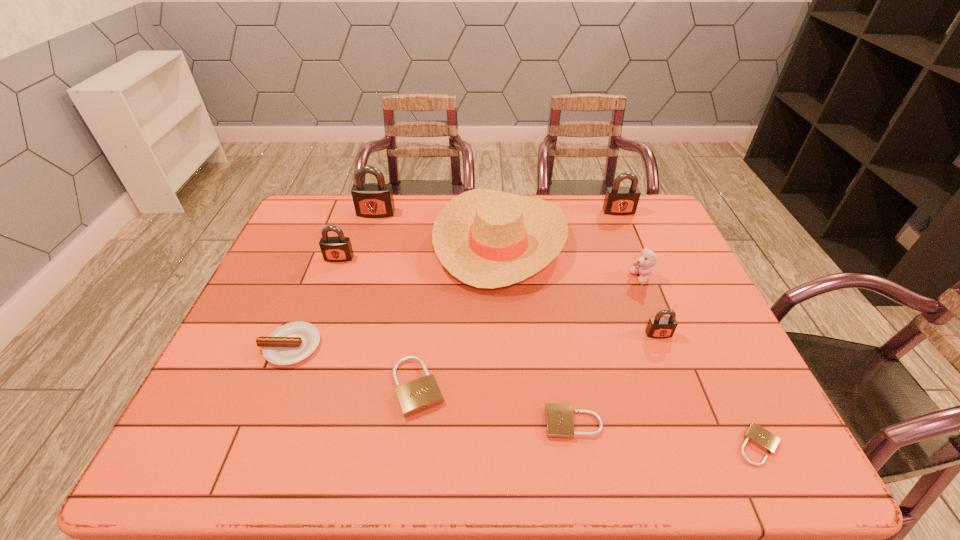
Find the location of a particular element. gray padlock that stands as the closest to the shortest object is located at coordinates (660, 327).

Choose which gray padlock is the third nearest neighbor to the fifth shortest padlock. Please provide its 2D coordinates. Your answer should be formatted as a tuple, i.e. [(x, y)], where the tuple contains the x and y coordinates of a point satisfying the conditions above.

[(660, 327)]

Find the location of a particular element. The image size is (960, 540). the closest beige padlock to the third padlock from left to right is located at coordinates (559, 418).

You are a GUI agent. You are given a task and a screenshot of the screen. Output one action in this format:
    pyautogui.click(x=<x>, y=<y>)
    Task: Click on the beige padlock object that ranks as the third closest to the fourth shortest padlock
    The height and width of the screenshot is (540, 960).
    Given the screenshot: What is the action you would take?
    pyautogui.click(x=418, y=395)

Where is `free space that satisfies the following two spatial constraints: 1. at the face of the teddy bear; 2. on the front side of the second smallest beige padlock`? free space that satisfies the following two spatial constraints: 1. at the face of the teddy bear; 2. on the front side of the second smallest beige padlock is located at coordinates (697, 423).

The width and height of the screenshot is (960, 540). I want to click on vacant space that satisfies the following two spatial constraints: 1. on the front of the third padlock from left to right near the keyhole; 2. on the right side of the second smallest gray padlock, so click(293, 387).

You are a GUI agent. You are given a task and a screenshot of the screen. Output one action in this format:
    pyautogui.click(x=<x>, y=<y>)
    Task: Click on the vacant region that satisfies the following two spatial constraints: 1. on the front side of the fourth padlock from left to right; 2. on the left side of the sunhat
    The width and height of the screenshot is (960, 540).
    Given the screenshot: What is the action you would take?
    pyautogui.click(x=511, y=423)

Locate an element on the screen. Image resolution: width=960 pixels, height=540 pixels. free location that satisfies the following two spatial constraints: 1. on the front of the biggest gray padlock near the keyhole; 2. on the right side of the third shortest padlock is located at coordinates (324, 387).

Image resolution: width=960 pixels, height=540 pixels. I want to click on free space that satisfies the following two spatial constraints: 1. on the front side of the ninth tallest object; 2. on the right side of the shortest object, so click(x=577, y=445).